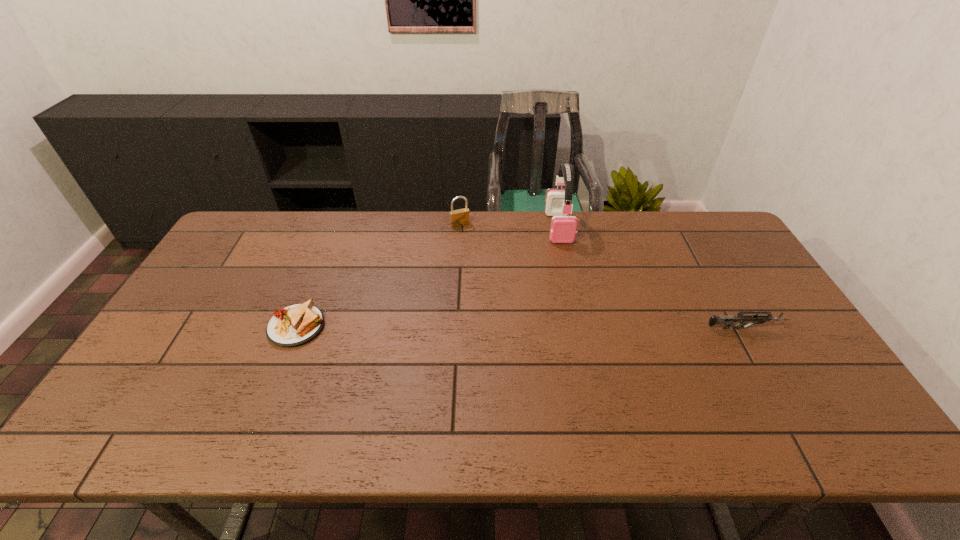
Find the location of a particular element. The width and height of the screenshot is (960, 540). vacant space on the desktop that is between the leftmost object and the rightmost object and is positioned on the front-facing side of the padlock is located at coordinates (516, 327).

Find the location of `vacant space on the desktop that is between the sandwich and the rightmost object and is positioned on the outer surface of the second object from right to left`. vacant space on the desktop that is between the sandwich and the rightmost object and is positioned on the outer surface of the second object from right to left is located at coordinates pyautogui.click(x=578, y=328).